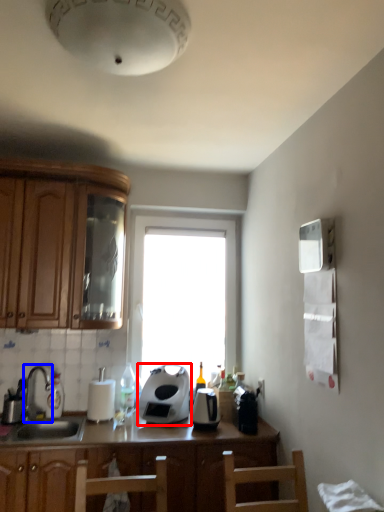
Question: Which object appears farthest to the camera in this image, kitchen appliance (highlighted by a red box) or tap (highlighted by a blue box)?

Choices:
 (A) kitchen appliance
 (B) tap

Answer: (A)